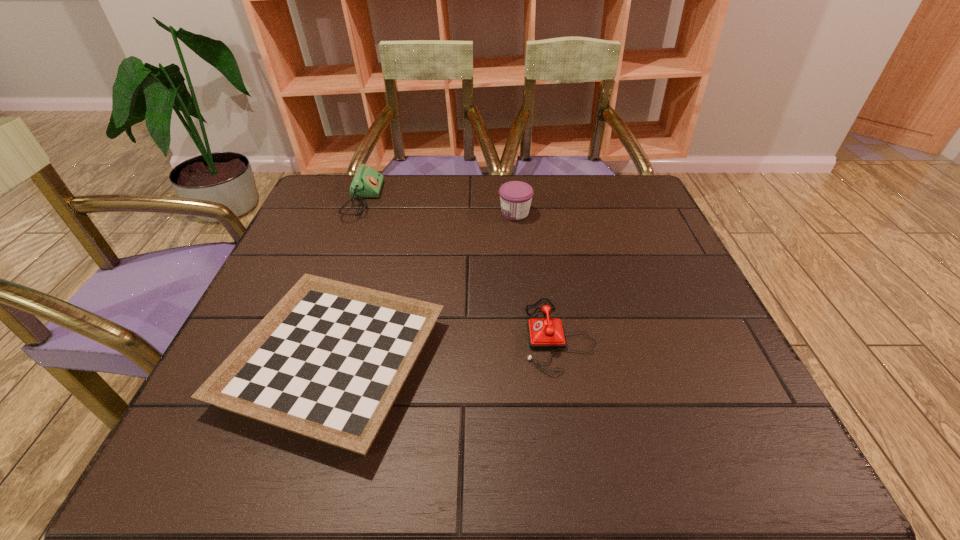
This screenshot has width=960, height=540. I want to click on free space between the left telephone and the checkerboard, so click(x=348, y=281).

At what (x,y) coordinates should I click in order to perform the action: click on vacant space that is in between the jam and the checkerboard. Please return your answer as a coordinate pair (x, y). Looking at the image, I should click on (424, 287).

This screenshot has width=960, height=540. Find the location of `vacant space that's between the jam and the nearer telephone`. vacant space that's between the jam and the nearer telephone is located at coordinates (537, 274).

Where is `vacant space that is in between the checkerboard and the right telephone`? vacant space that is in between the checkerboard and the right telephone is located at coordinates (446, 348).

Locate an element on the screen. This screenshot has width=960, height=540. vacant space that's between the shorter telephone and the farther telephone is located at coordinates (461, 267).

The image size is (960, 540). In order to click on vacant space that's between the shortest object and the farther telephone in this screenshot , I will do `click(348, 281)`.

Where is `vacant space that is in between the checkerboard and the shorter telephone`? This screenshot has width=960, height=540. vacant space that is in between the checkerboard and the shorter telephone is located at coordinates (446, 348).

Image resolution: width=960 pixels, height=540 pixels. Find the location of `free space that is in between the jam and the left telephone`. free space that is in between the jam and the left telephone is located at coordinates (439, 206).

Choose which object is the nearest neighbor to the jam. Please provide its 2D coordinates. Your answer should be formatted as a tuple, i.e. [(x, y)], where the tuple contains the x and y coordinates of a point satisfying the conditions above.

[(328, 361)]

Identify which object is located as the second nearest to the shorter telephone. Please provide its 2D coordinates. Your answer should be formatted as a tuple, i.e. [(x, y)], where the tuple contains the x and y coordinates of a point satisfying the conditions above.

[(515, 196)]